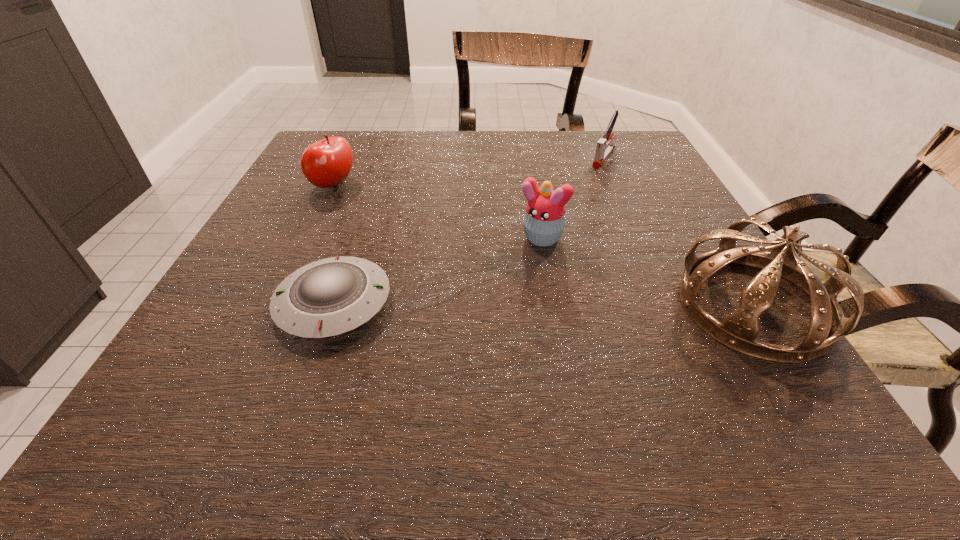
Where is `free region that satisfies the following two spatial constraints: 1. on the back side of the third object from left to right; 2. on the right side of the saucer`? This screenshot has width=960, height=540. free region that satisfies the following two spatial constraints: 1. on the back side of the third object from left to right; 2. on the right side of the saucer is located at coordinates (356, 238).

I want to click on free spot that satisfies the following two spatial constraints: 1. on the front side of the tiara; 2. on the left side of the cupcake, so click(x=550, y=306).

This screenshot has width=960, height=540. I want to click on free space in the image that satisfies the following two spatial constraints: 1. on the front side of the third farthest object; 2. on the right side of the tiara, so click(550, 306).